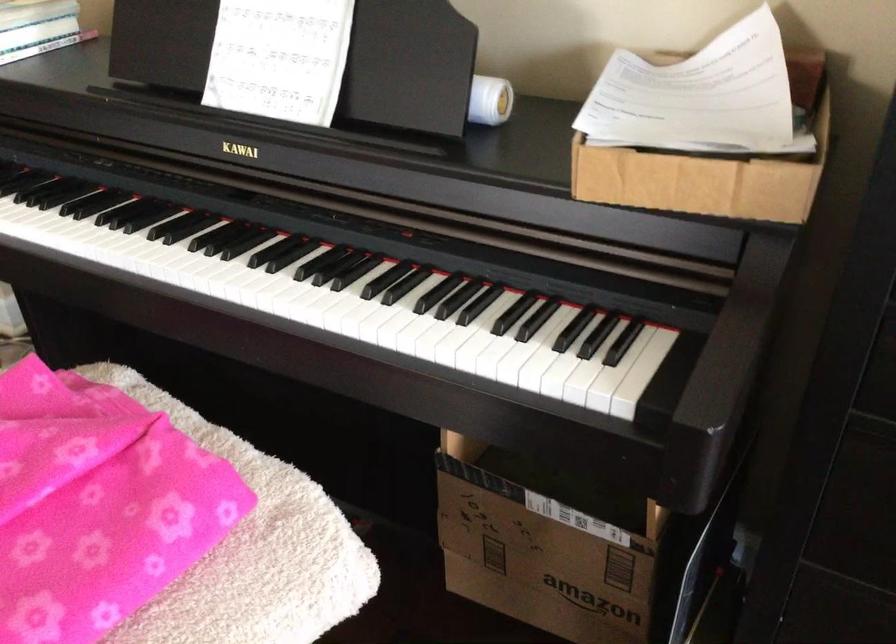
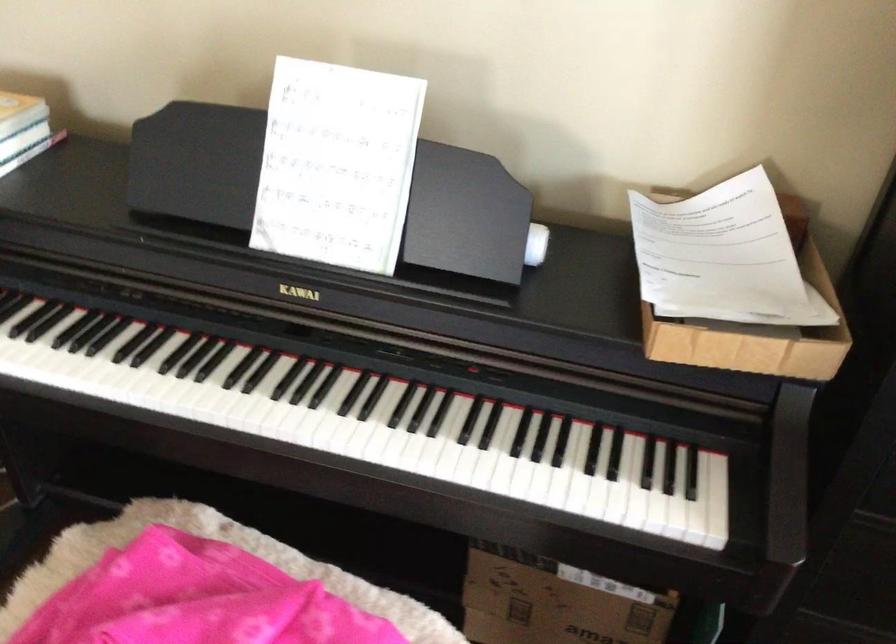
Locate, in the second image, the point that corresponds to pixel 99 243 in the first image.

(177, 397)